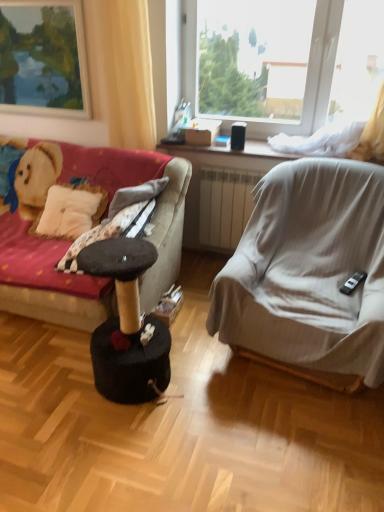
Where is `free space to the right of black felt cat tree at center`? The image size is (384, 512). free space to the right of black felt cat tree at center is located at coordinates (x=209, y=380).